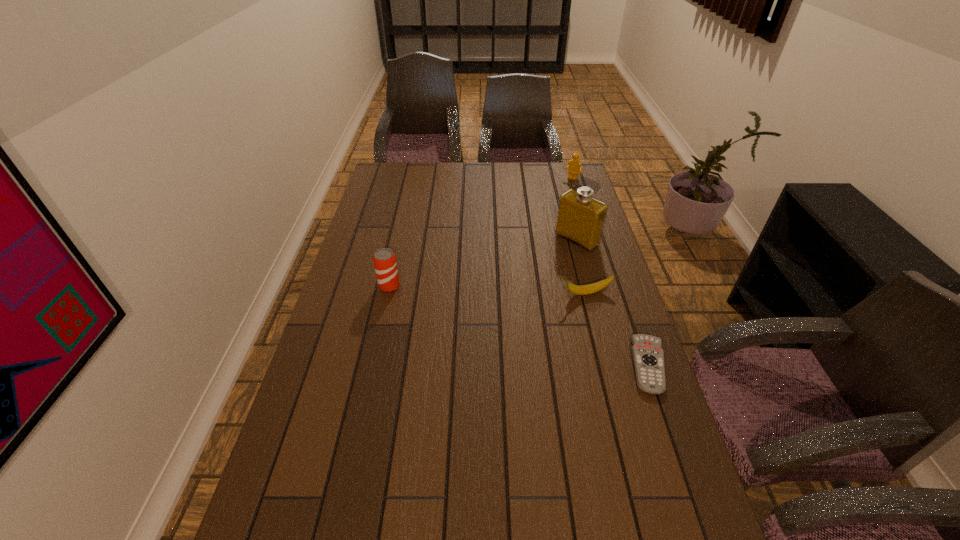
Where is `vacant space located 0.240m at the stem of the second shortest object`? vacant space located 0.240m at the stem of the second shortest object is located at coordinates (485, 308).

Where is `vacant space situated at the stem of the second shortest object`? vacant space situated at the stem of the second shortest object is located at coordinates (528, 300).

The width and height of the screenshot is (960, 540). Find the location of `free space located 0.290m on the front-facing side of the perfume`. free space located 0.290m on the front-facing side of the perfume is located at coordinates (511, 290).

The image size is (960, 540). Find the location of `vacant region located 0.350m on the front-facing side of the perfume`. vacant region located 0.350m on the front-facing side of the perfume is located at coordinates (498, 300).

Locate an element on the screen. vacant space located 0.320m on the front-facing side of the perfume is located at coordinates (505, 295).

I want to click on vacant space located on the face of the Lego, so click(560, 193).

Where is `vacant region located on the face of the Lego`? This screenshot has height=540, width=960. vacant region located on the face of the Lego is located at coordinates (553, 202).

Where is `vacant point located 0.110m on the face of the Lego`? The width and height of the screenshot is (960, 540). vacant point located 0.110m on the face of the Lego is located at coordinates (560, 194).

Identify the location of object at the far edge. The height and width of the screenshot is (540, 960). (575, 167).

Identify the location of object at the left edge. The width and height of the screenshot is (960, 540). (384, 259).